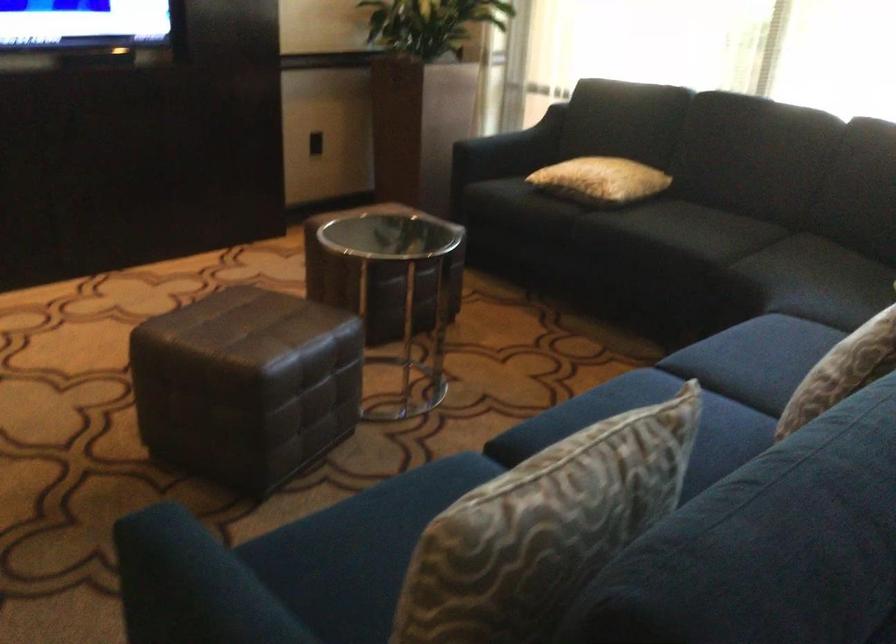
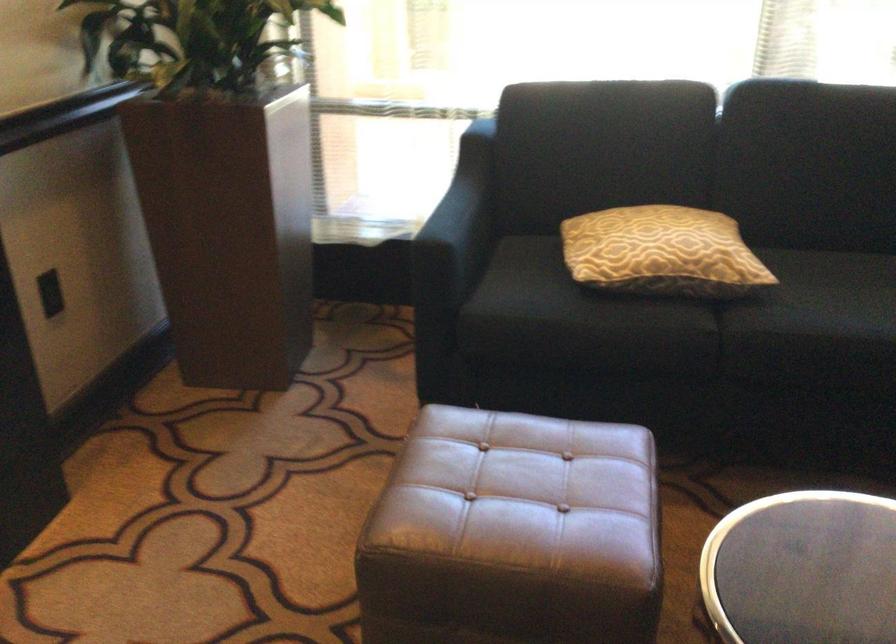
Locate, in the second image, the point that corresponds to the point at 574,172 in the first image.

(661, 252)